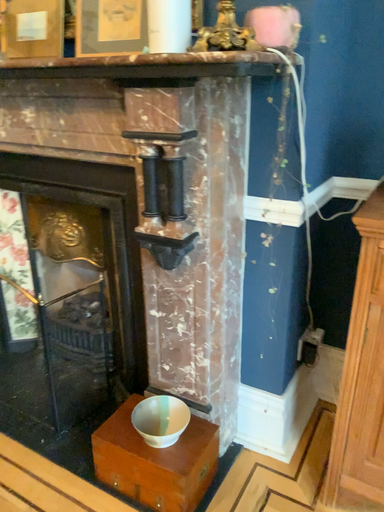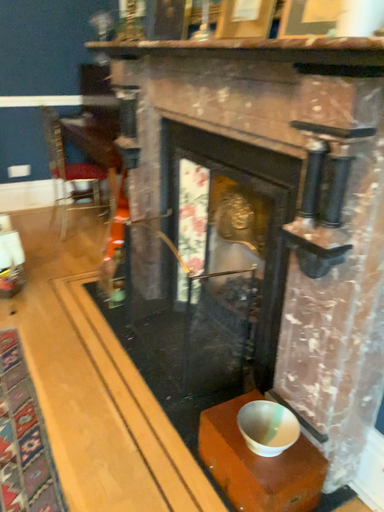
Question: How did the camera likely rotate when shooting the video?

Choices:
 (A) rotated right
 (B) rotated left

Answer: (B)